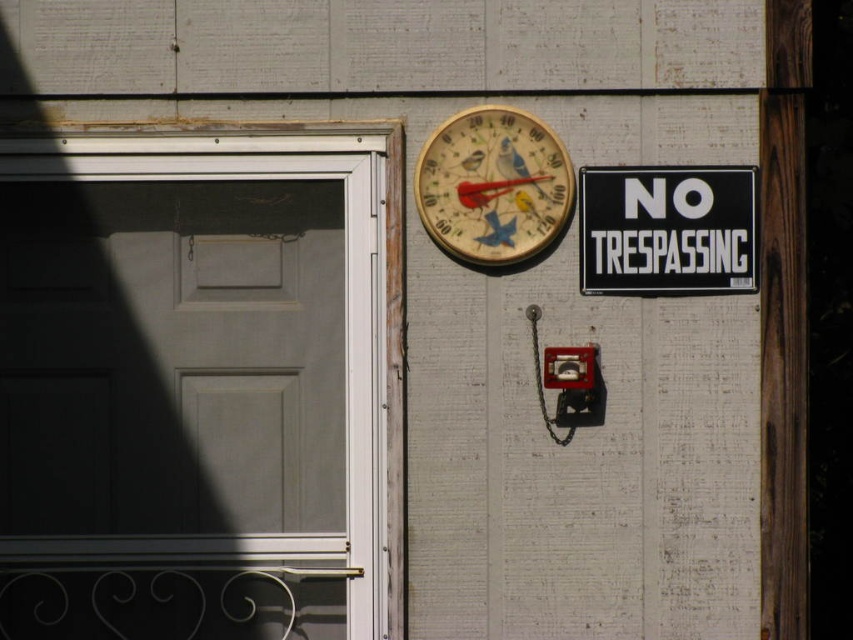
You are a delivery person trying to determine if the matte gray door at left is large enough to fit a package that requires a minimum height clearance of 2 meters. Given that the wooden painted thermometer at upper center is 1.5 meters tall, can you estimate whether the door meets the requirement?

The matte gray door at left is taller than the wooden painted thermometer at upper center, which is 1.5 meters tall. Therefore, the door is taller than 1.5 meters, but since the required clearance is 2 meters, we cannot confirm if it meets the requirement without knowing the exact height of the door.

You are a painter who needs to know which object is taller between the matte gray door at left and the black plastic sign at upper right. Based on the scene description, which one is taller?

The matte gray door at left is taller than the black plastic sign at upper right according to the description.